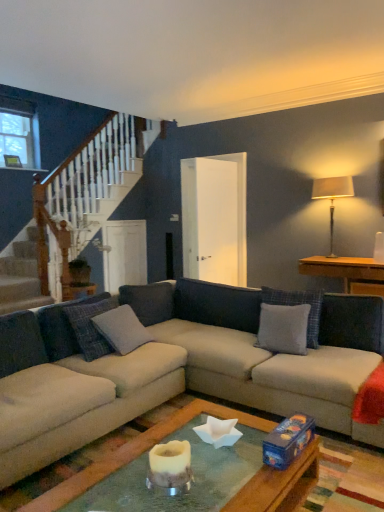
Question: Is gray fabric pillow at center, acting as the 4th pillow starting from the right, taller or shorter than beige fabric couch at center?

Choices:
 (A) short
 (B) tall

Answer: (A)

Question: From the image's perspective, is gray fabric pillow at center, which ranks as the first pillow in left-to-right order, located above or below beige fabric couch at center?

Choices:
 (A) above
 (B) below

Answer: (A)

Question: Based on their relative distances, which object is nearer to the silky beige lampshade at upper right?

Choices:
 (A) gray fabric pillow at center, which ranks as the first pillow in left-to-right order
 (B) white ceramic candle holder at center
 (C) gray fabric pillow at center, arranged as the 2th pillow when viewed from the right
 (D) beige fabric couch at center
 (E) gray fabric pillow at center, which is counted as the 2th pillow, starting from the left

Answer: (C)

Question: Which is nearer to the gray fabric pillow at center, the 1th pillow positioned from the right?

Choices:
 (A) gray fabric pillow at center, which ranks as the first pillow in left-to-right order
 (B) beige fabric couch at center
 (C) gray fabric pillow at center, the third pillow positioned from the left
 (D) silky beige lampshade at upper right
 (E) white ceramic candle holder at center

Answer: (C)